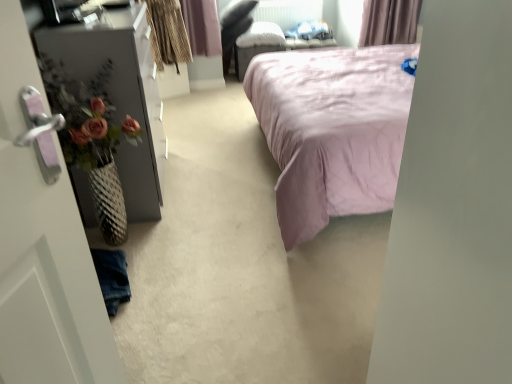
Question: Is pink satin bed at center in front of or behind matte black dresser at left in the image?

Choices:
 (A) front
 (B) behind

Answer: (A)

Question: From the image's perspective, is pink satin bed at center positioned above or below matte black dresser at left?

Choices:
 (A) above
 (B) below

Answer: (A)

Question: Estimate the real-world distances between objects in this image. Which object is farther from the white plastic radiator at upper center?

Choices:
 (A) matte black dresser at left
 (B) pink satin bed at center

Answer: (A)

Question: Considering the real-world distances, which object is farthest from the pink satin bed at center?

Choices:
 (A) matte black dresser at left
 (B) white plastic radiator at upper center

Answer: (B)